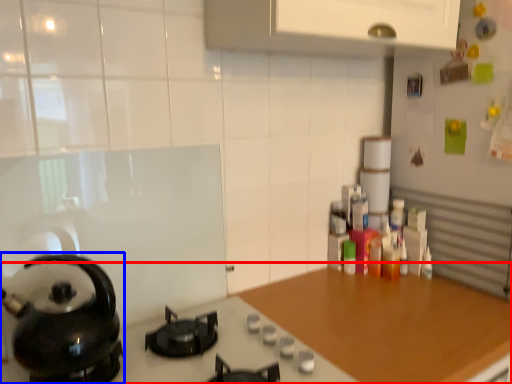
Question: Among these objects, which one is nearest to the camera, countertop (highlighted by a red box) or kitchen appliance (highlighted by a blue box)?

Choices:
 (A) countertop
 (B) kitchen appliance

Answer: (B)